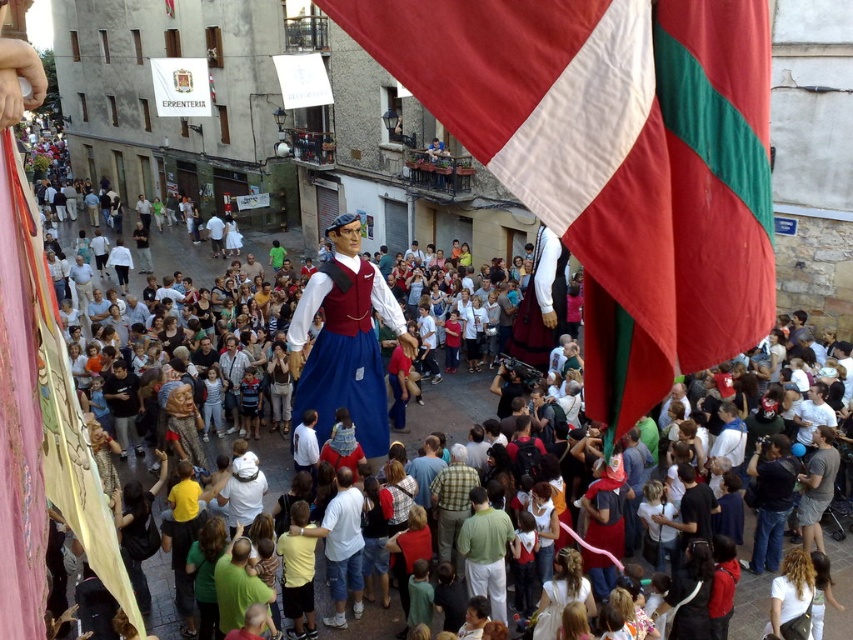
You are a photographer trying to capture the entire scene of the red fabric flag at center and the green plaid shirt at center in one shot. Considering their sizes, which object should you focus on to ensure both are visible in the frame?

The red fabric flag at center is much taller than the green plaid shirt at center, so you should focus on the red fabric flag at center to ensure both are visible in the frame.

You are a participant in the street festival and need to locate the red fabric flag at center. According to the scene description, where exactly is the red fabric flag positioned?

The red fabric flag at center is located at point (613, 160).